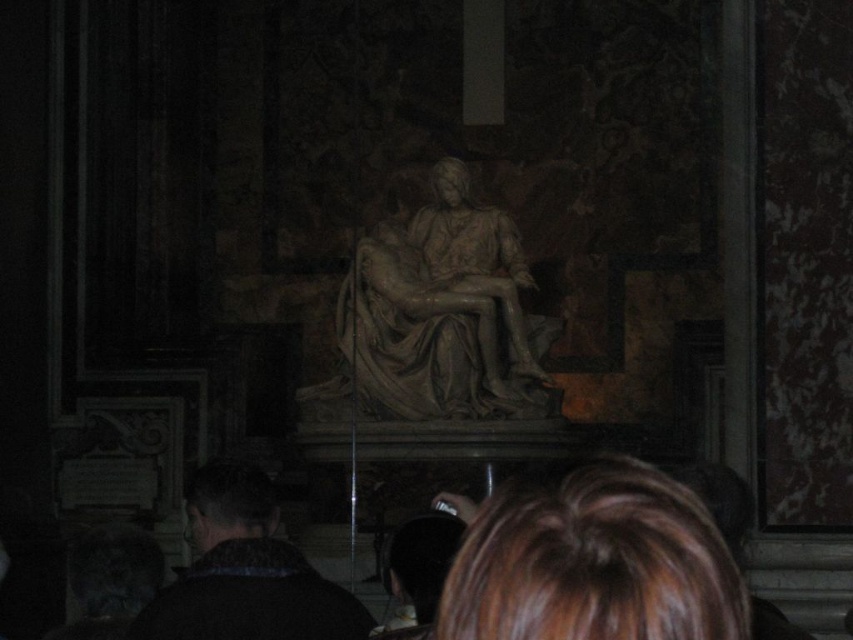
You are standing in the cathedral and want to take a photo of the sculpture. The two points you are focusing on are point [651,605] and point [190,609]. Which point should you focus on to ensure it appears sharper in the photo?

Point [651,605] is closer to the camera than point [190,609], so focusing on point [651,605] will ensure it appears sharper in the photo.

You are an architect planning to install a new lighting fixture in this space. The fixture requires a minimum of 2 meters of clearance from any object. Given the brown hair at lower center and the gray stone sculpture at center, which object do you need to consider for the clearance requirement?

The gray stone sculpture at center must be considered for the clearance requirement because its width is larger than the brown hair at lower center, making it the object that requires more space. Since the fixture needs 2 meters of clearance, the architect should ensure the sculpture is at least 2 meters away from the fixture.